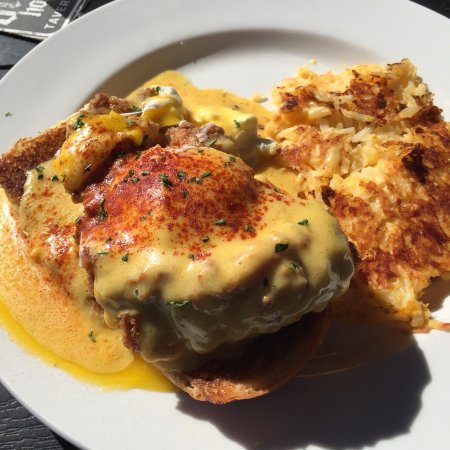
Find the location of a particular element. Image resolution: width=450 pixels, height=450 pixels. white ceramic plate is located at coordinates (123, 410).